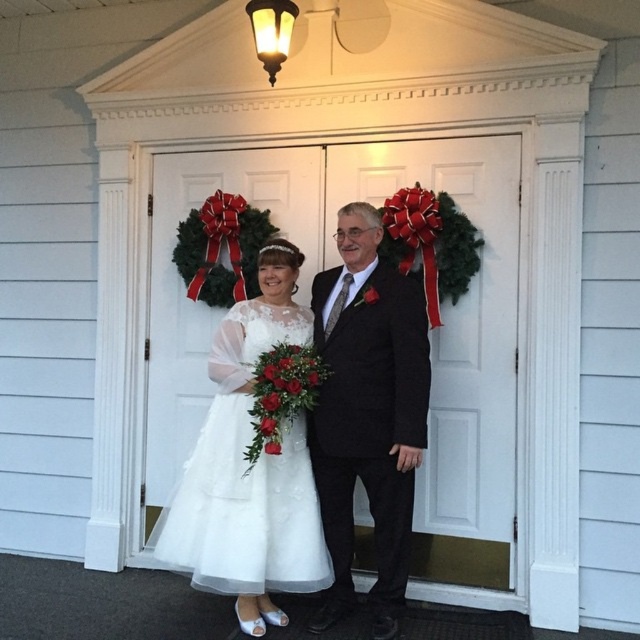
Measure the distance between white matte door at center and white satin bouquet at center.

A distance of 83.84 centimeters exists between white matte door at center and white satin bouquet at center.

Between point (156, 316) and point (273, 454), which one is positioned behind?

The point (156, 316) is behind.

Find the location of a particular element. white matte door at center is located at coordinates (x=429, y=332).

Between point (321, 474) and point (244, 390), which one is positioned behind?

The point (321, 474) is more distant.

I want to click on black satin suit at center, so click(x=368, y=412).

Identify the location of black satin suit at center. (368, 412).

Does white matte door at center come behind white lace dress at center?

That is True.

Looking at this image, which is below, white matte door at center or white lace dress at center?

white lace dress at center is below.

Where is `white matte door at center`? This screenshot has height=640, width=640. white matte door at center is located at coordinates (429, 332).